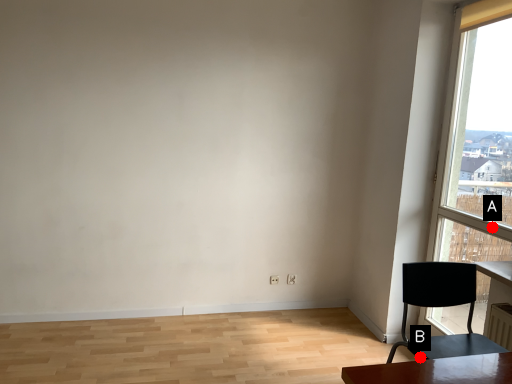
Question: Two points are circled on the image, labeled by A and B beside each circle. Which point appears closest to the camera in this image?

Choices:
 (A) A is closer
 (B) B is closer

Answer: (B)